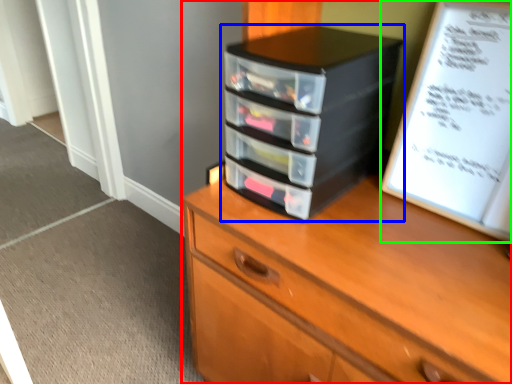
Question: Estimate the real-world distances between objects in this image. Which object is farther from chest of drawers (highlighted by a red box), nightstand (highlighted by a blue box) or paperback book (highlighted by a green box)?

Choices:
 (A) nightstand
 (B) paperback book

Answer: (B)